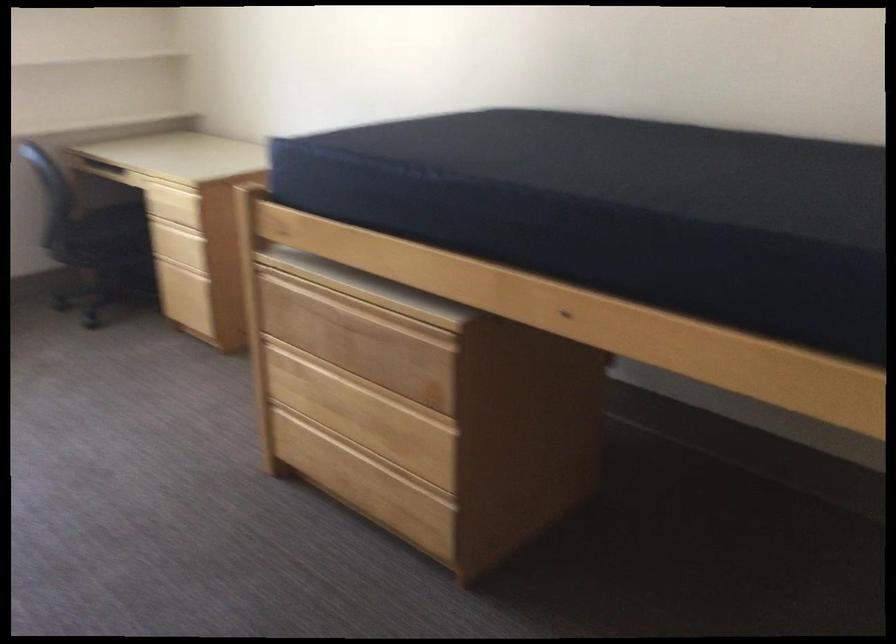
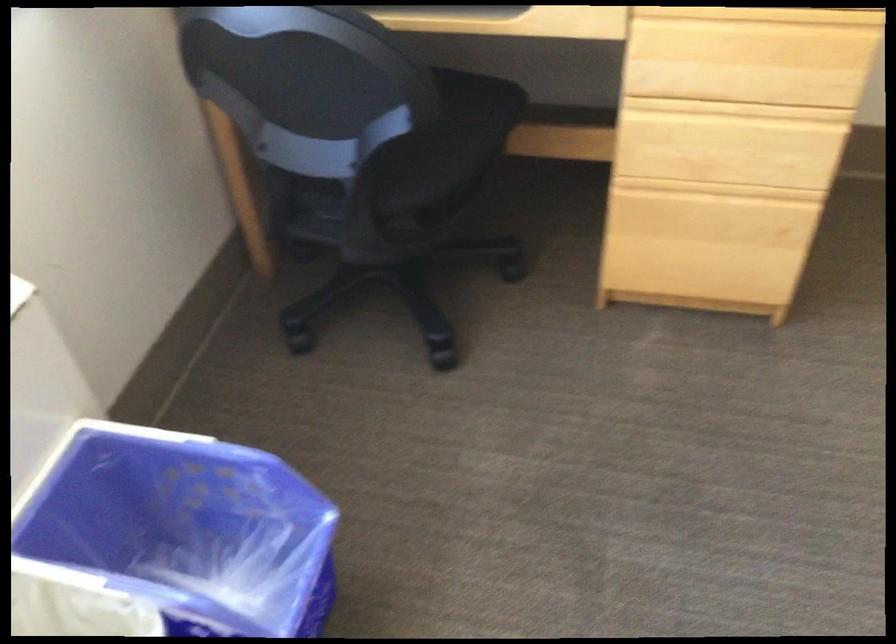
Where in the second image is the point corresponding to point 185,261 from the first image?

(718, 190)